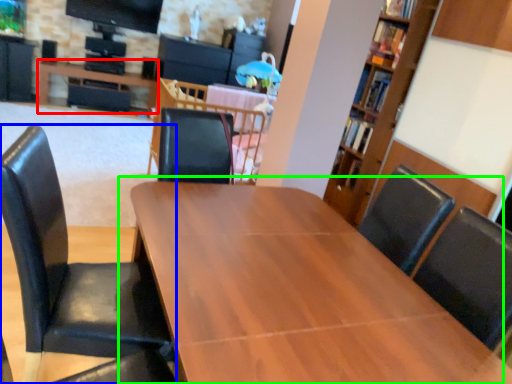
Question: Based on their relative distances, which object is farther from table (highlighted by a red box)? Choose from chair (highlighted by a blue box) and table (highlighted by a green box).

Choices:
 (A) chair
 (B) table

Answer: (A)